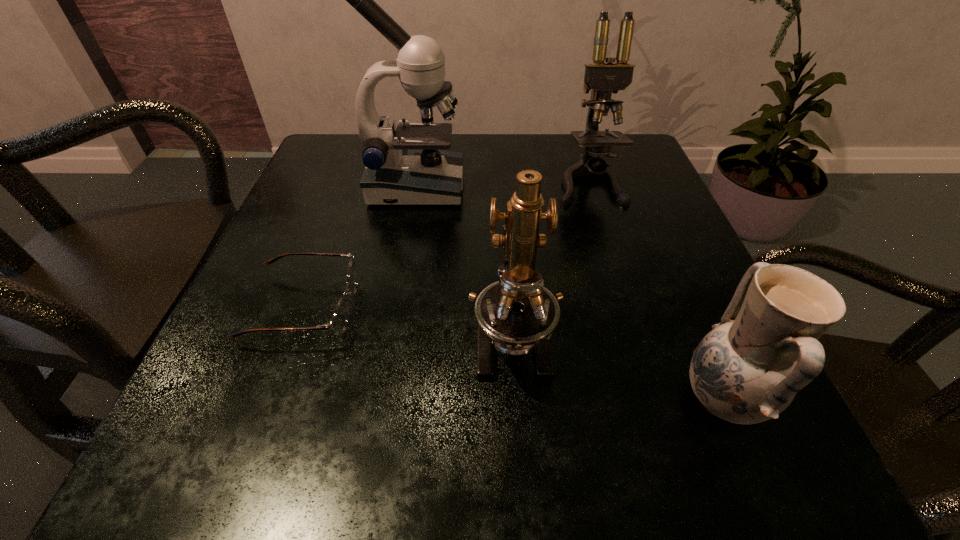
The width and height of the screenshot is (960, 540). Identify the location of free space located on either side of the fourth tallest object. (376, 399).

I want to click on vacant region located 0.290m on either side of the fourth tallest object, so click(454, 399).

This screenshot has height=540, width=960. Identify the location of vacant region located 0.150m on either side of the fourth tallest object. (563, 399).

Where is `free location located 0.380m on the front-facing side of the shortest object`? free location located 0.380m on the front-facing side of the shortest object is located at coordinates (602, 308).

This screenshot has height=540, width=960. I want to click on object at the near edge, so click(x=748, y=369).

This screenshot has width=960, height=540. I want to click on microscope at the left edge, so click(407, 165).

Locate an element on the screen. spectacles present at the left edge is located at coordinates (339, 320).

I want to click on microscope that is at the right edge, so click(603, 79).

Locate an element on the screen. Image resolution: width=960 pixels, height=540 pixels. pottery present at the right edge is located at coordinates pos(748,369).

At what (x,y) coordinates should I click in order to perform the action: click on object at the far left corner. Please return your answer as a coordinate pair (x, y). This screenshot has width=960, height=540. Looking at the image, I should click on (407, 165).